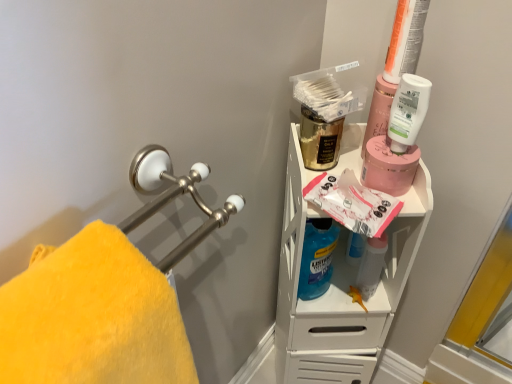
Question: Based on their sizes in the image, would you say pink matte jar at upper right is bigger or smaller than gold metallic mouthwash at upper center, placed as the 1th mouthwash when sorted from left to right?

Choices:
 (A) big
 (B) small

Answer: (B)

Question: Does point (398, 178) appear closer or farther from the camera than point (323, 127)?

Choices:
 (A) farther
 (B) closer

Answer: (B)

Question: Based on their relative distances, which object is nearer to the matte white shelf at upper right?

Choices:
 (A) matte gray spray bottle at center, the second cleaning product positioned from the left
 (B) translucent plastic mouthwash at upper right, arranged as the second mouthwash when viewed from the left
 (C) blue translucent liquid at center, which is the 2th cleaning product from top to bottom
 (D) white matte lotion at upper right, marked as the 3th cleaning product in a bottom-to-top arrangement
 (E) yellow plush towel at left

Answer: (C)

Question: Considering the real-world distances, which object is farthest from the gold metallic mouthwash at upper center, which is the second mouthwash from right to left?

Choices:
 (A) yellow plush towel at left
 (B) matte white shelf at upper right
 (C) blue translucent liquid at center, the first cleaning product positioned from the left
 (D) matte gray spray bottle at center, which appears as the 2th cleaning product when viewed from the right
 (E) translucent plastic mouthwash at upper right, which appears as the 1th mouthwash when viewed from the right

Answer: (A)